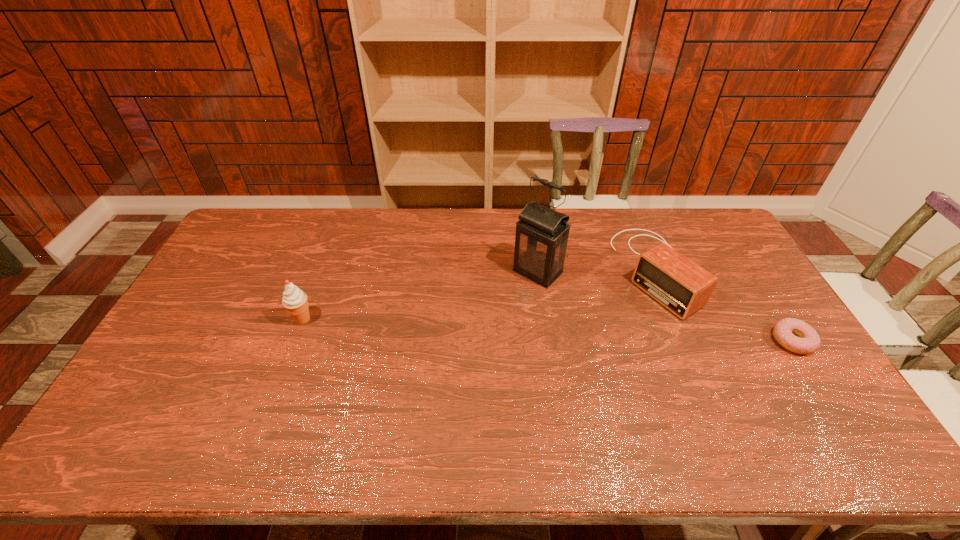
Find the location of a particular element. This screenshot has width=960, height=540. free space at the left edge of the desktop is located at coordinates (228, 318).

I want to click on vacant position at the right edge of the desktop, so click(758, 330).

You are a GUI agent. You are given a task and a screenshot of the screen. Output one action in this format:
    pyautogui.click(x=<x>, y=<y>)
    Task: Click on the vacant space at the far right corner of the desktop
    
    Given the screenshot: What is the action you would take?
    701,233

Image resolution: width=960 pixels, height=540 pixels. Identify the location of free spot between the third shortest object and the third object from left to right. (477, 295).

Locate an element on the screen. vacant area that lies between the radio receiver and the second tallest object is located at coordinates (477, 295).

Find the location of a particular element. free space that is in between the leftmost object and the rightmost object is located at coordinates (547, 330).

At what (x,y) coordinates should I click in order to perform the action: click on free space between the rightmost object and the icecream. Please return your answer as a coordinate pair (x, y). This screenshot has width=960, height=540. Looking at the image, I should click on (547, 330).

Image resolution: width=960 pixels, height=540 pixels. I want to click on free spot between the lantern and the third tallest object, so click(595, 271).

You are a GUI agent. You are given a task and a screenshot of the screen. Output one action in this format:
    pyautogui.click(x=<x>, y=<y>)
    Task: Click on the vacant area that lies between the lantern and the leftmost object
    
    Given the screenshot: What is the action you would take?
    pyautogui.click(x=420, y=295)

Image resolution: width=960 pixels, height=540 pixels. I want to click on unoccupied position between the leftmost object and the tallest object, so click(x=420, y=295).